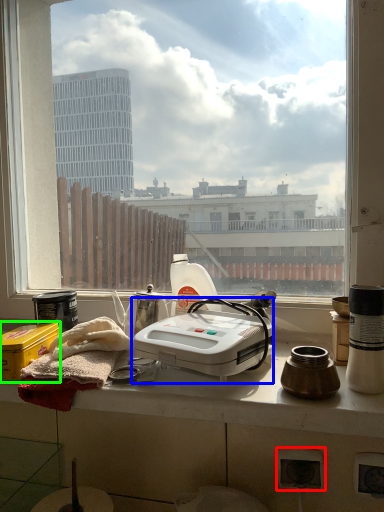
Question: Based on their relative distances, which object is farther from power plugs and sockets (highlighted by a red box)? Choose from kitchen appliance (highlighted by a blue box) and box (highlighted by a green box).

Choices:
 (A) kitchen appliance
 (B) box

Answer: (B)